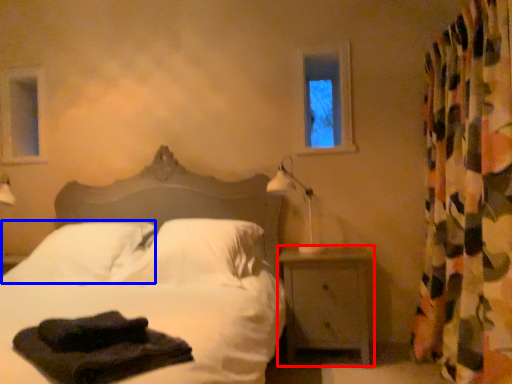
Question: Among these objects, which one is nearest to the camera, nightstand (highlighted by a red box) or pillow (highlighted by a blue box)?

Choices:
 (A) nightstand
 (B) pillow

Answer: (B)